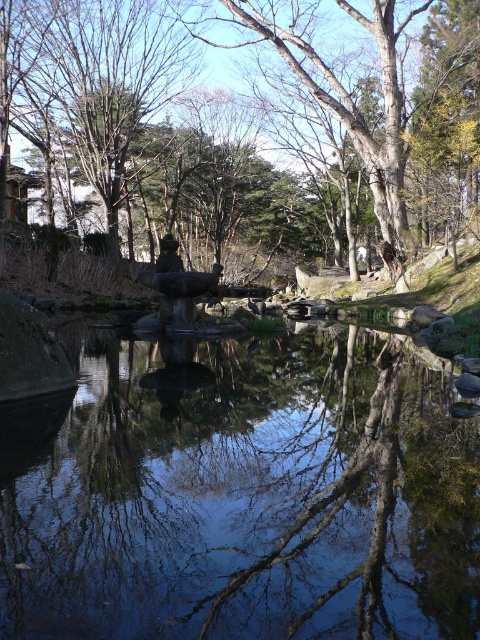
In the scene shown: Which of these two, transparent water at center or brown wood tree at center, stands taller?

brown wood tree at center is taller.

Is transparent water at center positioned before brown wood tree at center?

Yes, it is.

Measure the distance between transparent water at center and camera.

transparent water at center is 3.12 meters from camera.

This screenshot has height=640, width=480. Identify the location of transparent water at center. (241, 493).